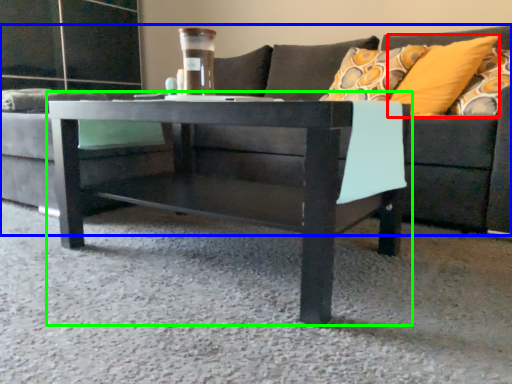
Question: Which object is the closest to the pillow (highlighted by a red box)? Choose among these: studio couch (highlighted by a blue box) or coffee table (highlighted by a green box).

Choices:
 (A) studio couch
 (B) coffee table

Answer: (A)